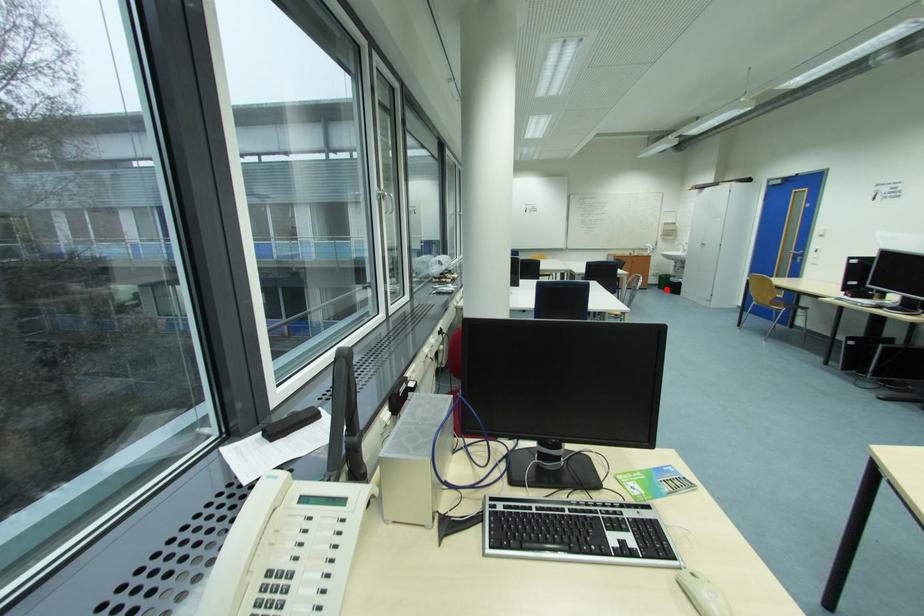
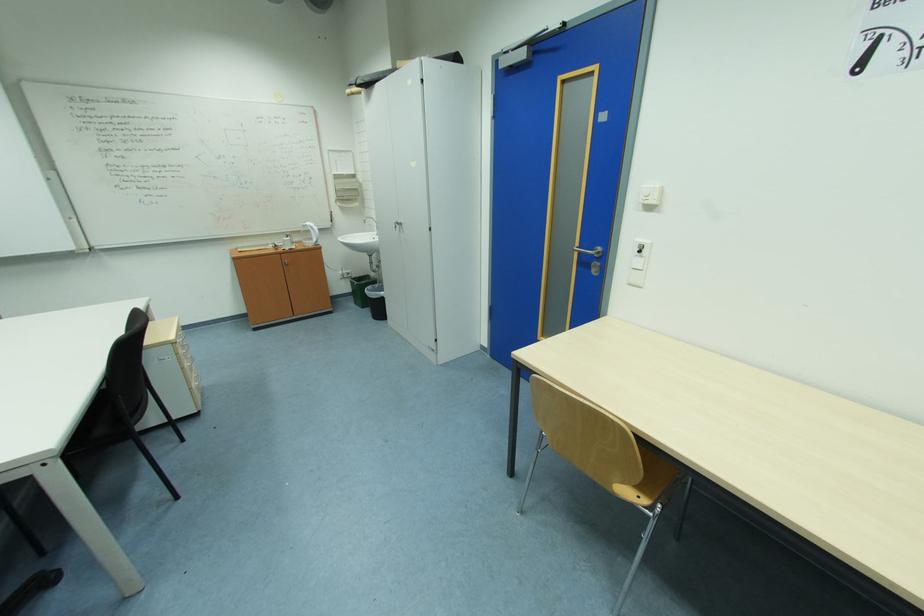
Locate, in the second image, the point that corresponds to the highlighted location in the first image.

(362, 304)